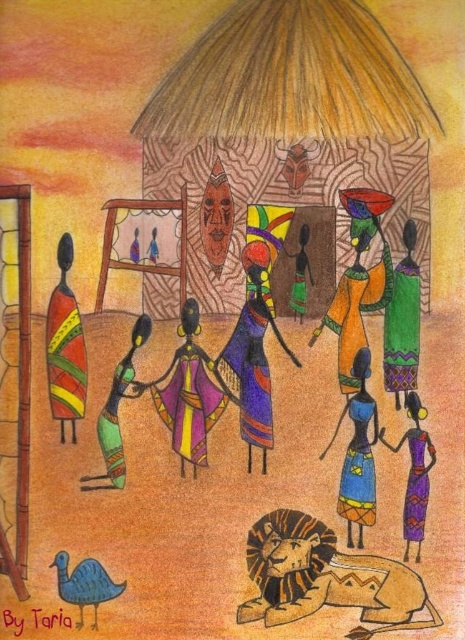
Who is more forward, (337, 577) or (203, 461)?

Positioned in front is point (337, 577).

Can you confirm if brown textured lion at lower center is positioned to the right of purple fabric dress at center?

Yes, brown textured lion at lower center is to the right of purple fabric dress at center.

What are the coordinates of `brown textured lion at lower center` in the screenshot? It's located at (325, 579).

Does purple fabric dress at center appear on the right side of matte green dress at center?

No, purple fabric dress at center is not to the right of matte green dress at center.

Is purple fabric dress at center below matte green dress at center?

Yes.

Which is behind, point (199, 403) or point (293, 252)?

Point (293, 252)

The width and height of the screenshot is (465, 640). In order to click on purple fabric dress at center in this screenshot , I will do `click(188, 394)`.

Does purple fabric dress at center have a smaller size compared to purple fabric dress at lower right?

No, purple fabric dress at center is not smaller than purple fabric dress at lower right.

Can you confirm if purple fabric dress at center is positioned to the right of purple fabric dress at lower right?

In fact, purple fabric dress at center is to the left of purple fabric dress at lower right.

This screenshot has width=465, height=640. What do you see at coordinates (188, 394) in the screenshot?
I see `purple fabric dress at center` at bounding box center [188, 394].

Identify the location of purple fabric dress at center. (188, 394).